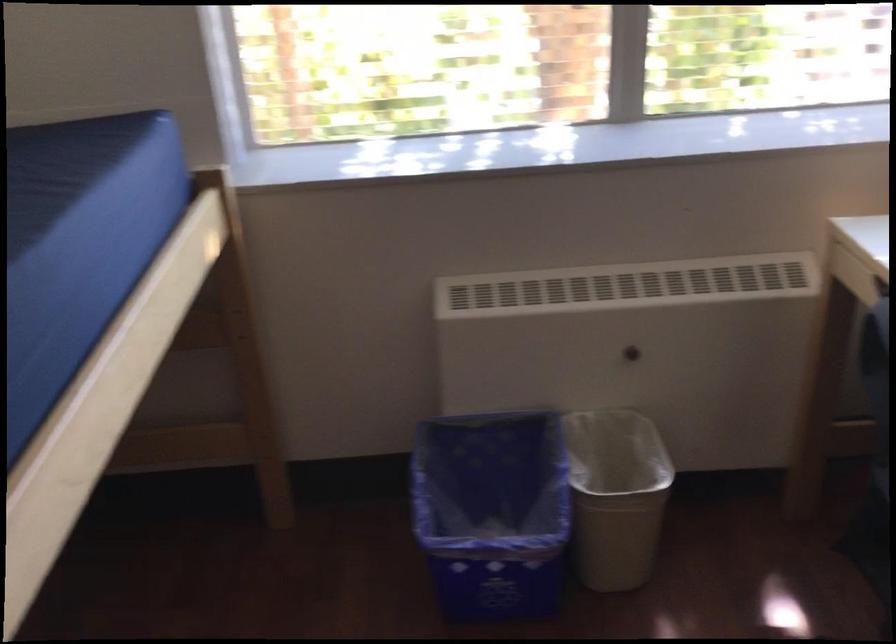
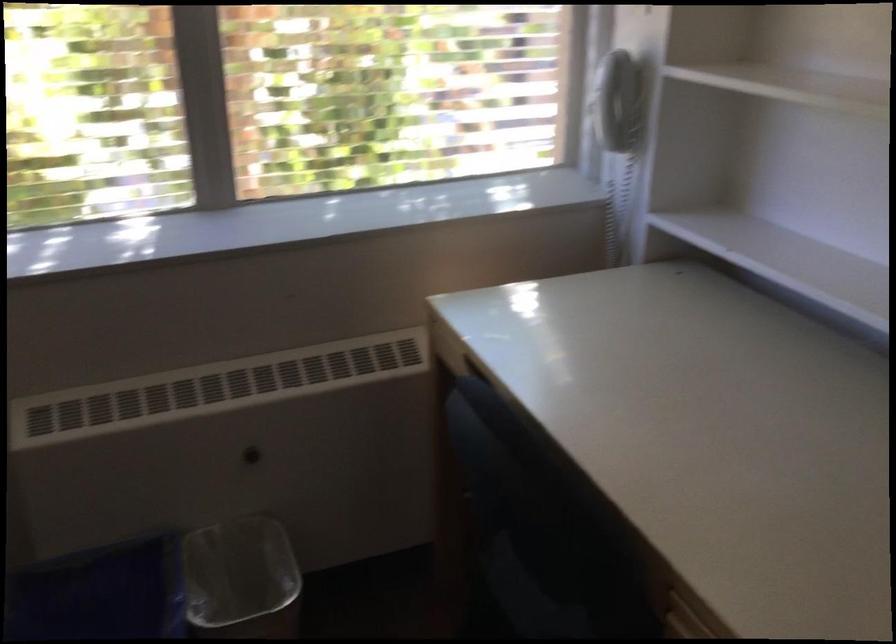
Question: The camera is either moving clockwise (left) or counter-clockwise (right) around the object. The first image is from the beginning of the video and the second image is from the end. Is the camera moving left or right when shooting the video?

Choices:
 (A) Left
 (B) Right

Answer: (A)